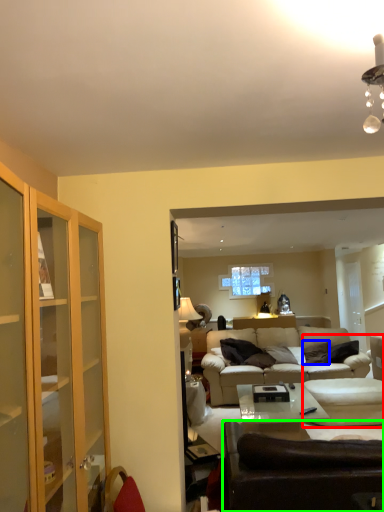
Question: Considering the real-world distances, which object is closest to swivel chair (highlighted by a red box)? pillow (highlighted by a blue box) or studio couch (highlighted by a green box).

Choices:
 (A) pillow
 (B) studio couch

Answer: (A)